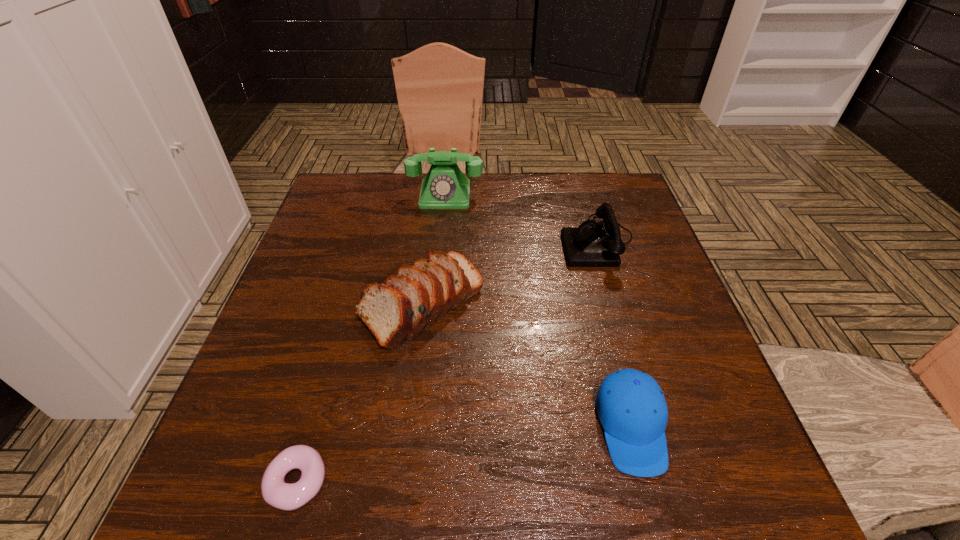
The height and width of the screenshot is (540, 960). What are the coordinates of `vacant point located between the left telephone and the cap` in the screenshot? It's located at click(539, 311).

You are a GUI agent. You are given a task and a screenshot of the screen. Output one action in this format:
    pyautogui.click(x=<x>, y=<y>)
    Task: Click on the vacant space in between the left telephone and the cap
    The width and height of the screenshot is (960, 540).
    Given the screenshot: What is the action you would take?
    pyautogui.click(x=539, y=311)

Where is `free spot between the cap and the doughnut`? This screenshot has height=540, width=960. free spot between the cap and the doughnut is located at coordinates (464, 454).

Where is `empty space that is in between the bread and the shortest object`? empty space that is in between the bread and the shortest object is located at coordinates (359, 392).

Locate an element on the screen. The image size is (960, 540). free space between the bread and the cap is located at coordinates (526, 364).

The width and height of the screenshot is (960, 540). In order to click on unoccupied area between the left telephone and the shorter telephone in this screenshot , I will do `click(521, 218)`.

Image resolution: width=960 pixels, height=540 pixels. In order to click on object identified as the closest to the shorter telephone in this screenshot , I will do `click(445, 186)`.

Locate which object ranks in proximity to the shorter telephone. Please provide its 2D coordinates. Your answer should be formatted as a tuple, i.e. [(x, y)], where the tuple contains the x and y coordinates of a point satisfying the conditions above.

[(445, 186)]